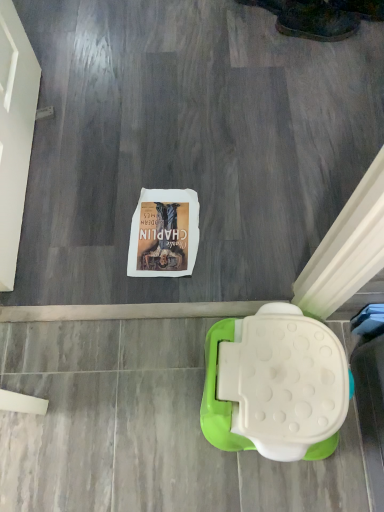
Identify the location of vacant space in front of leather boot at upper right. Image resolution: width=384 pixels, height=512 pixels. (316, 66).